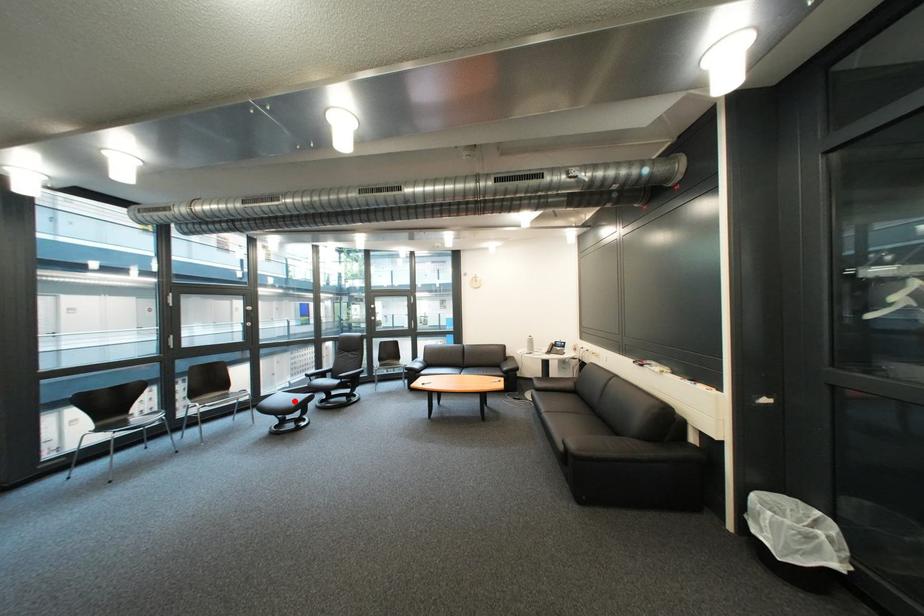
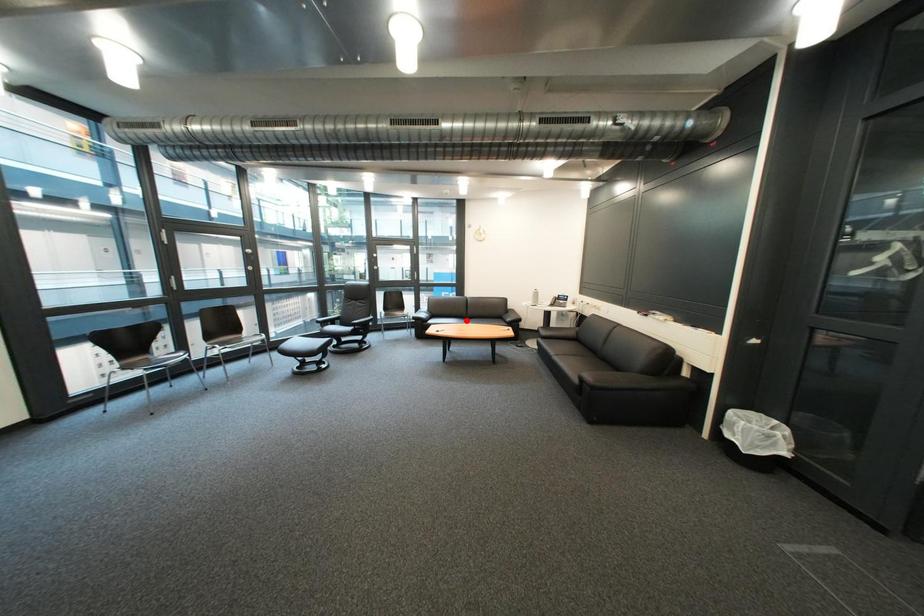
I am providing you with two images of the same scene from different viewpoints. A red point is marked on the first image and another point is marked on the second image. Are the points marked in image1 and image2 representing the same 3D position?

No